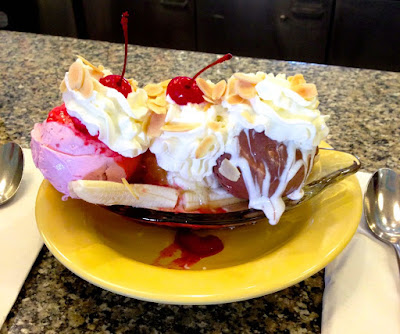
The height and width of the screenshot is (334, 400). In order to click on white tissue paper in this screenshot , I will do click(x=365, y=305), click(x=29, y=259).